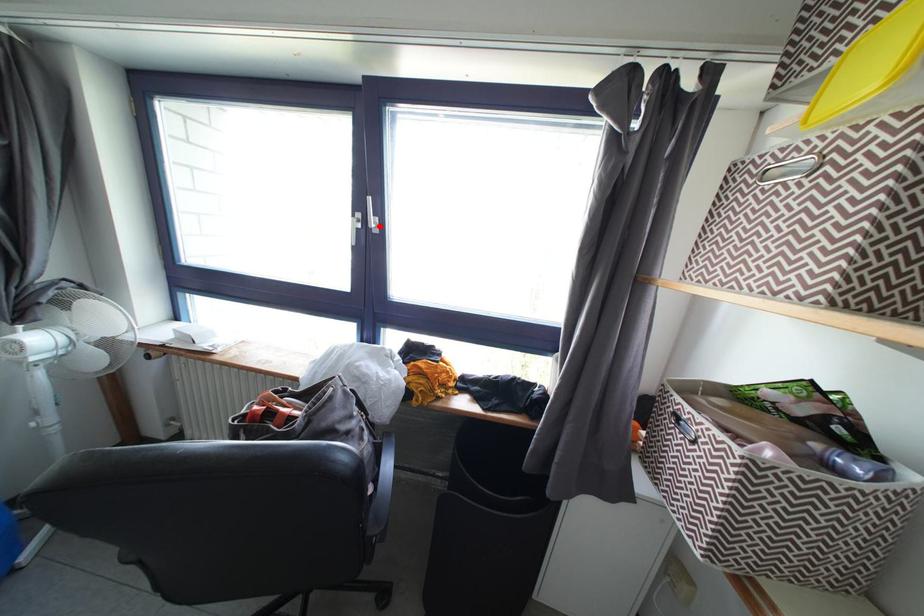
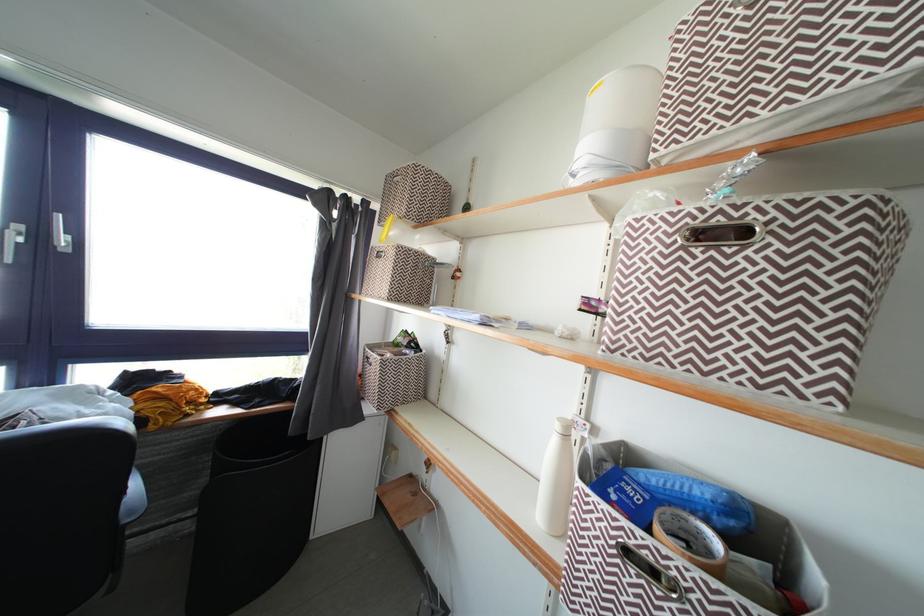
Question: I am providing you with two images of the same scene from different viewpoints. A red point is marked on the first image. Is the red point's position out of view in image 2?

Choices:
 (A) Yes
 (B) No

Answer: (B)